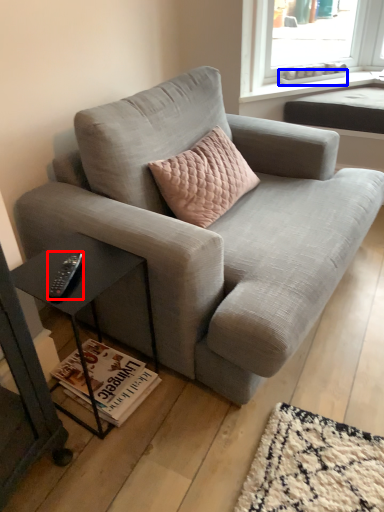
Question: Which of the following is the closest to the observer, remote (highlighted by a red box) or window sill (highlighted by a blue box)?

Choices:
 (A) remote
 (B) window sill

Answer: (A)